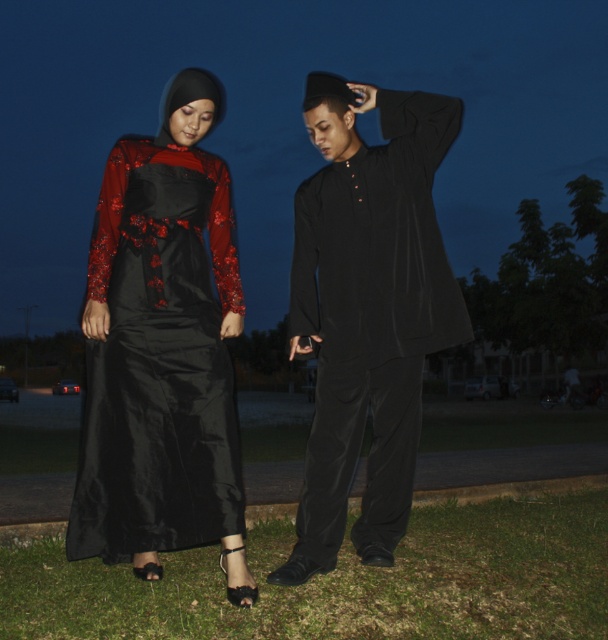
Is point (412, 250) farther from camera compared to point (449, 509)?

No.

Who is more distant from viewer, (367, 554) or (278, 532)?

The point (278, 532) is behind.

Image resolution: width=608 pixels, height=640 pixels. I want to click on matte black kurti at center, so click(367, 308).

Does shiny satin dress at center appear under green grass at lower center?

No, shiny satin dress at center is not below green grass at lower center.

Does shiny satin dress at center have a greater width compared to green grass at lower center?

No, shiny satin dress at center is not wider than green grass at lower center.

The width and height of the screenshot is (608, 640). In order to click on shiny satin dress at center in this screenshot , I will do `click(367, 308)`.

Between shiny satin dress at center and shiny black dress at left, which one has less height?

shiny black dress at left is shorter.

Between point (294, 248) and point (171, 468), which one is positioned in front?

Positioned in front is point (171, 468).

Is point (337, 426) positioned behind point (209, 344)?

Yes, it is behind point (209, 344).

Identify the location of shiny satin dress at center. Image resolution: width=608 pixels, height=640 pixels. (367, 308).